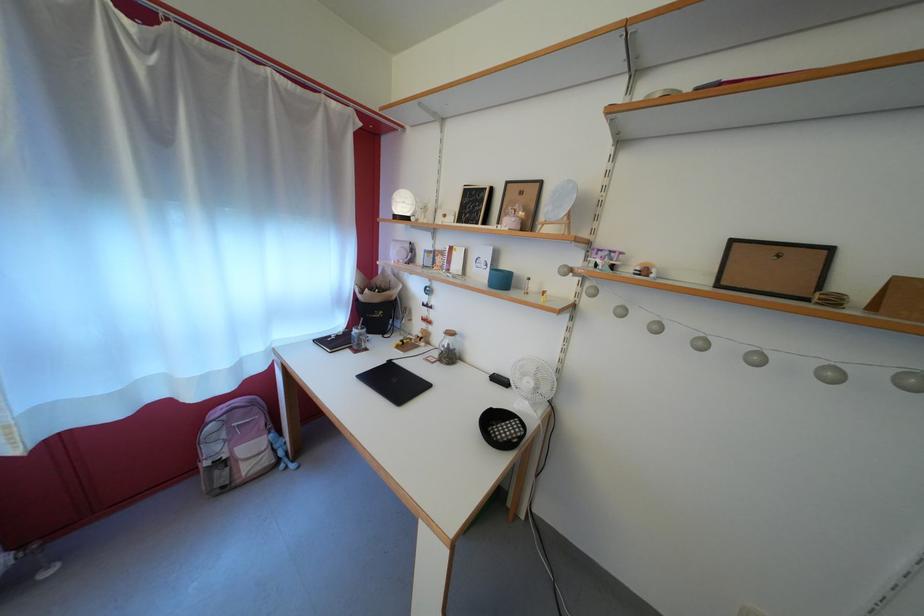
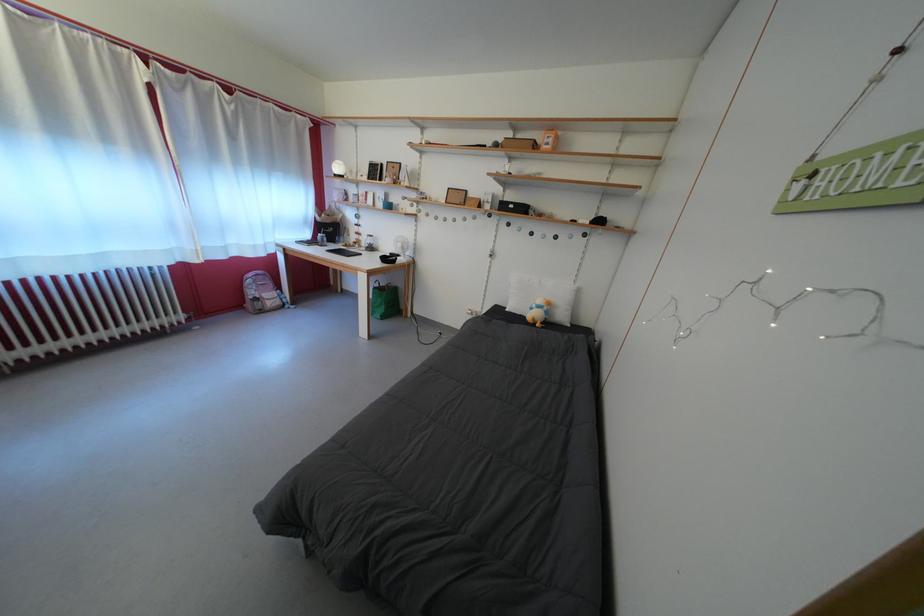
The point at (432, 331) is marked in the first image. Where is the corresponding point in the second image?

(365, 243)